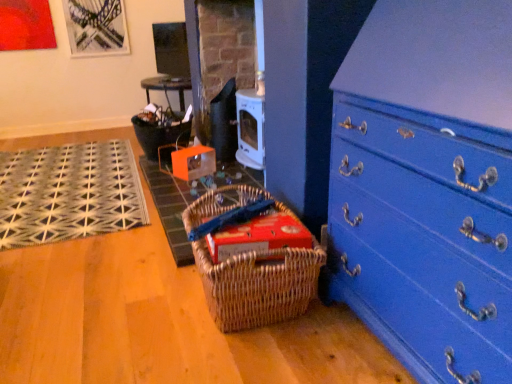
From the picture: Measure the distance between woven mat at center, the first doormat in the right-to-left sequence, and camera.

The depth of woven mat at center, the first doormat in the right-to-left sequence, is 1.68 meters.

Measure the distance between matte black basket at center and camera.

matte black basket at center and camera are 2.75 meters apart.

Find the location of a particular element. The image size is (512, 384). woven brown picnic basket at lower center is located at coordinates (259, 284).

This screenshot has height=384, width=512. Find the location of `red cardboard box at center`. red cardboard box at center is located at coordinates (259, 236).

Find the location of `black woven mat at left, acting as the second doormat starting from the right`. black woven mat at left, acting as the second doormat starting from the right is located at coordinates pyautogui.click(x=69, y=193).

Considering the sizes of red cardboard box at center and black woven mat at left, which is the first doormat from left to right, in the image, is red cardboard box at center taller or shorter than black woven mat at left, which is the first doormat from left to right,?

Considering their sizes, red cardboard box at center has more height than black woven mat at left, which is the first doormat from left to right.

Does red cardboard box at center turn towards black woven mat at left, which is the first doormat from left to right?

No, red cardboard box at center is not oriented towards black woven mat at left, which is the first doormat from left to right.

Is red cardboard box at center in front of black woven mat at left, which is the first doormat from left to right?

Yes.

Which of these two, matte black basket at center or woven mat at center, the first doormat in the right-to-left sequence, stands taller?

With more height is matte black basket at center.

Which object is closer to the camera, matte black basket at center or woven mat at center, the first doormat in the right-to-left sequence?

woven mat at center, the first doormat in the right-to-left sequence, is closer to the camera.

Considering the positions of objects matte black basket at center and woven mat at center, which is counted as the 2th doormat, starting from the left, in the image provided, who is more to the right, matte black basket at center or woven mat at center, which is counted as the 2th doormat, starting from the left,?

woven mat at center, which is counted as the 2th doormat, starting from the left, is more to the right.

Consider the image. Does matte black basket at center have a larger size compared to woven mat at center, which is counted as the 2th doormat, starting from the left?

No.

Does woven brown picnic basket at lower center come behind matte black basket at center?

No, woven brown picnic basket at lower center is in front of matte black basket at center.

Is matte black basket at center at the back of woven brown picnic basket at lower center?

No, woven brown picnic basket at lower center's orientation is not away from matte black basket at center.

Considering the sizes of objects woven brown picnic basket at lower center and matte black basket at center in the image provided, who is smaller, woven brown picnic basket at lower center or matte black basket at center?

Smaller between the two is matte black basket at center.

Which of these two, woven brown picnic basket at lower center or matte black basket at center, stands shorter?

woven brown picnic basket at lower center is shorter.

Considering the sizes of woven mat at center, which is counted as the 2th doormat, starting from the left, and woven brown picnic basket at lower center in the image, is woven mat at center, which is counted as the 2th doormat, starting from the left, taller or shorter than woven brown picnic basket at lower center?

Clearly, woven mat at center, which is counted as the 2th doormat, starting from the left, is shorter compared to woven brown picnic basket at lower center.

Considering the positions of objects woven mat at center, which is counted as the 2th doormat, starting from the left, and woven brown picnic basket at lower center in the image provided, who is in front, woven mat at center, which is counted as the 2th doormat, starting from the left, or woven brown picnic basket at lower center?

woven brown picnic basket at lower center is more forward.

Locate an element on the screen. The width and height of the screenshot is (512, 384). picnic basket located below the woven mat at center, which is counted as the 2th doormat, starting from the left (from the image's perspective) is located at coordinates (259, 284).

Is woven mat at center, the first doormat in the right-to-left sequence, inside the boundaries of woven brown picnic basket at lower center, or outside?

woven mat at center, the first doormat in the right-to-left sequence, is not inside woven brown picnic basket at lower center, it's outside.

How much distance is there between woven brown picnic basket at lower center and blue painted wood chest of drawers at lower right?

They are 16.26 inches apart.

From the image's perspective, is woven brown picnic basket at lower center over blue painted wood chest of drawers at lower right?

Incorrect, from the image's perspective, woven brown picnic basket at lower center is lower than blue painted wood chest of drawers at lower right.

Considering the relative sizes of woven brown picnic basket at lower center and blue painted wood chest of drawers at lower right in the image provided, is woven brown picnic basket at lower center smaller than blue painted wood chest of drawers at lower right?

Yes.

In the image, is woven brown picnic basket at lower center on the left side or the right side of blue painted wood chest of drawers at lower right?

From the image, it's evident that woven brown picnic basket at lower center is to the left of blue painted wood chest of drawers at lower right.

Is black woven mat at left, acting as the second doormat starting from the right, thinner than matte black basket at center?

No.

Is black woven mat at left, which is the first doormat from left to right, with matte black basket at center?

No.

Does black woven mat at left, which is the first doormat from left to right, turn towards matte black basket at center?

No, black woven mat at left, which is the first doormat from left to right, is not facing towards matte black basket at center.

From the image's perspective, does black woven mat at left, acting as the second doormat starting from the right, appear higher than matte black basket at center?

No, from the image's perspective, black woven mat at left, acting as the second doormat starting from the right, is not over matte black basket at center.

Is blue painted wood chest of drawers at lower right taller than woven brown picnic basket at lower center?

Correct, blue painted wood chest of drawers at lower right is much taller as woven brown picnic basket at lower center.

Measure the distance from blue painted wood chest of drawers at lower right to woven brown picnic basket at lower center.

The distance of blue painted wood chest of drawers at lower right from woven brown picnic basket at lower center is 16.26 inches.

Which is more to the left, blue painted wood chest of drawers at lower right or woven brown picnic basket at lower center?

Positioned to the left is woven brown picnic basket at lower center.

How many degrees apart are the facing directions of blue painted wood chest of drawers at lower right and woven brown picnic basket at lower center?

blue painted wood chest of drawers at lower right and woven brown picnic basket at lower center are facing 0.153 degrees away from each other.

This screenshot has height=384, width=512. What are the coordinates of `storage box on the right of the black woven mat at left, acting as the second doormat starting from the right` in the screenshot? It's located at (259, 236).

In order to click on basket above the woven mat at center, which is counted as the 2th doormat, starting from the left (from a real-world perspective) in this screenshot , I will do `click(157, 135)`.

Looking at the image, which one is located closer to matte black basket at center, red cardboard box at center or blue painted wood chest of drawers at lower right?

Among the two, red cardboard box at center is located nearer to matte black basket at center.

Looking at the image, which one is located closer to woven brown picnic basket at lower center, blue painted wood chest of drawers at lower right or red cardboard box at center?

red cardboard box at center is closer to woven brown picnic basket at lower center.

Looking at the image, which one is located closer to blue painted wood chest of drawers at lower right, black woven mat at left, acting as the second doormat starting from the right, or woven mat at center, the first doormat in the right-to-left sequence?

The object closer to blue painted wood chest of drawers at lower right is woven mat at center, the first doormat in the right-to-left sequence.

Based on the photo, based on their spatial positions, is black woven mat at left, acting as the second doormat starting from the right, or woven brown picnic basket at lower center closer to matte black basket at center?

black woven mat at left, acting as the second doormat starting from the right, is closer to matte black basket at center.

From the image, which object appears to be nearer to black woven mat at left, acting as the second doormat starting from the right, matte black basket at center or woven mat at center, which is counted as the 2th doormat, starting from the left?

woven mat at center, which is counted as the 2th doormat, starting from the left, lies closer to black woven mat at left, acting as the second doormat starting from the right, than the other object.

Based on their spatial positions, is woven brown picnic basket at lower center or woven mat at center, the first doormat in the right-to-left sequence, further from blue painted wood chest of drawers at lower right?

Based on the image, woven mat at center, the first doormat in the right-to-left sequence, appears to be further to blue painted wood chest of drawers at lower right.

From the image, which object appears to be nearer to black woven mat at left, which is the first doormat from left to right, blue painted wood chest of drawers at lower right or matte black basket at center?

matte black basket at center is closer to black woven mat at left, which is the first doormat from left to right.

Based on their spatial positions, is woven brown picnic basket at lower center or woven mat at center, the first doormat in the right-to-left sequence, further from red cardboard box at center?

woven mat at center, the first doormat in the right-to-left sequence, lies further to red cardboard box at center than the other object.

The height and width of the screenshot is (384, 512). What are the coordinates of `picnic basket between blue painted wood chest of drawers at lower right and woven mat at center, the first doormat in the right-to-left sequence, along the z-axis` in the screenshot? It's located at (259, 284).

Where is `picnic basket between blue painted wood chest of drawers at lower right and red cardboard box at center along the z-axis`? picnic basket between blue painted wood chest of drawers at lower right and red cardboard box at center along the z-axis is located at coordinates click(x=259, y=284).

The width and height of the screenshot is (512, 384). I want to click on storage box located between black woven mat at left, which is the first doormat from left to right, and blue painted wood chest of drawers at lower right in the left-right direction, so click(x=259, y=236).

Where is `storage box between woven brown picnic basket at lower center and woven mat at center, the first doormat in the right-to-left sequence, from front to back`? The width and height of the screenshot is (512, 384). storage box between woven brown picnic basket at lower center and woven mat at center, the first doormat in the right-to-left sequence, from front to back is located at coordinates (259, 236).